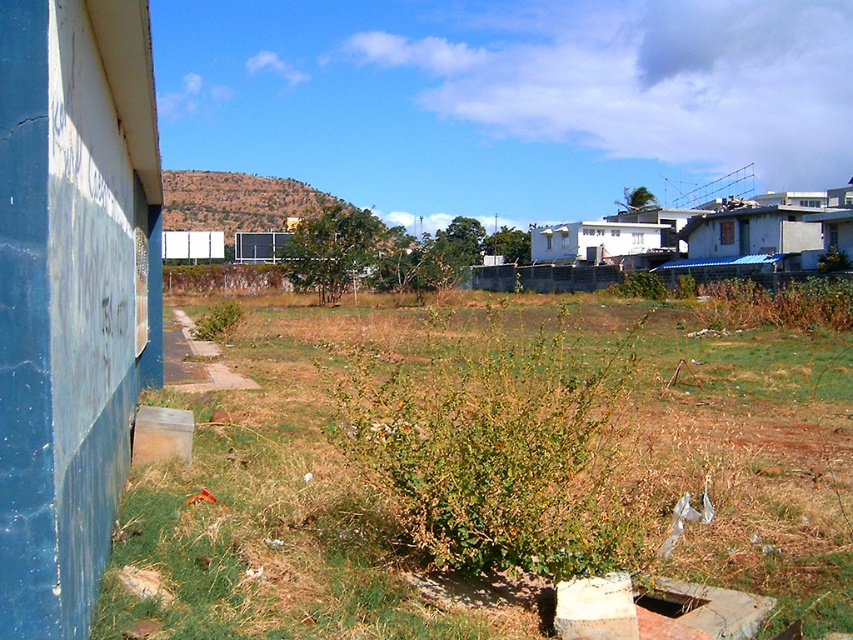
Can you confirm if green leafy bush at center is thinner than dark brown concrete hole at lower center?

No.

Which is behind, point (461, 419) or point (645, 589)?

The point (461, 419) is behind.

I want to click on green leafy bush at center, so click(505, 452).

Image resolution: width=853 pixels, height=640 pixels. In order to click on green leafy bush at center in this screenshot , I will do `click(505, 452)`.

Does green grass at lower left have a lesser width compared to dark brown concrete hole at lower center?

No.

Does point (663, 497) come behind point (701, 598)?

Yes, point (663, 497) is behind point (701, 598).

Is point (287, 600) behind point (660, 602)?

No, (287, 600) is closer to viewer.

This screenshot has height=640, width=853. I want to click on green grass at lower left, so click(282, 506).

Can you confirm if green grass at lower left is taller than green leafy bush at center?

Indeed, green grass at lower left has a greater height compared to green leafy bush at center.

Does green grass at lower left appear under green leafy bush at center?

No, green grass at lower left is not below green leafy bush at center.

Does point (676, 416) lie behind point (556, 467)?

Yes.

Locate an element on the screen. The width and height of the screenshot is (853, 640). green grass at lower left is located at coordinates pos(282,506).